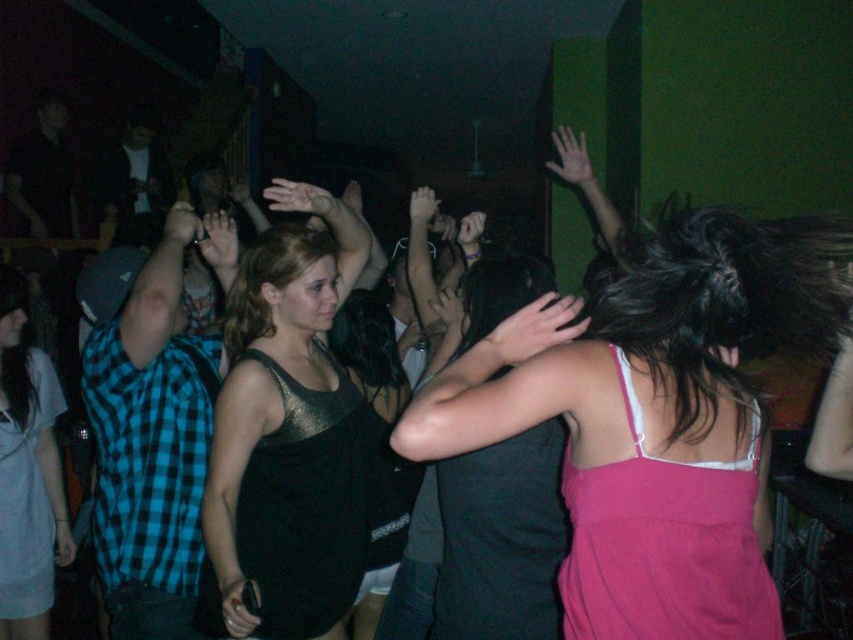
Question: Based on their relative distances, which object is nearer to the metallic tank top at center?

Choices:
 (A) shiny black dress at center
 (B) pink fabric dress at center

Answer: (A)

Question: Does pink fabric dress at center lie in front of metallic tank top at center?

Choices:
 (A) no
 (B) yes

Answer: (B)

Question: Considering the real-world distances, which object is closest to the pink satin dress at upper right?

Choices:
 (A) metallic tank top at center
 (B) pink fabric dress at center
 (C) shiny black dress at center

Answer: (B)

Question: Is shiny black dress at center to the right of pink satin dress at upper right from the viewer's perspective?

Choices:
 (A) no
 (B) yes

Answer: (A)

Question: Estimate the real-world distances between objects in this image. Which object is closer to the pink fabric dress at center?

Choices:
 (A) metallic tank top at center
 (B) shiny black dress at center
 (C) pink satin dress at upper right

Answer: (C)

Question: Is pink fabric dress at center above metallic tank top at center?

Choices:
 (A) yes
 (B) no

Answer: (A)